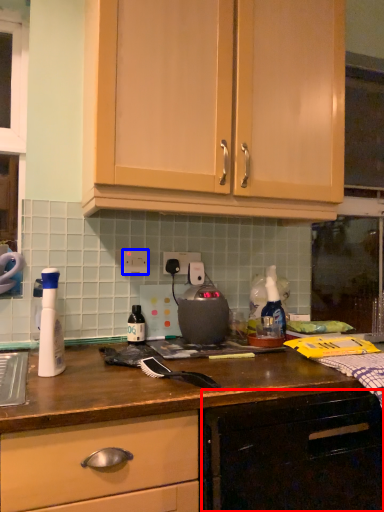
Question: Among these objects, which one is nearest to the camera, cabinetry (highlighted by a red box) or electric outlet (highlighted by a blue box)?

Choices:
 (A) cabinetry
 (B) electric outlet

Answer: (A)